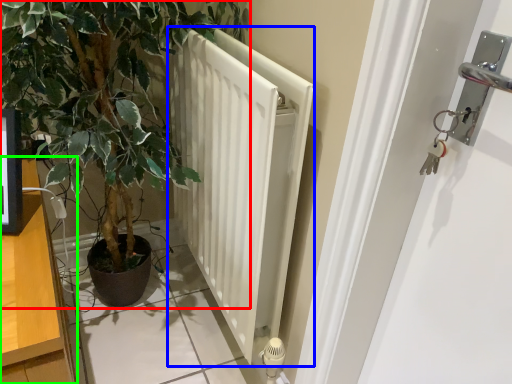
Question: Which is nearer to the houseplant (highlighted by a red box)? radiator (highlighted by a blue box) or dresser (highlighted by a green box).

Choices:
 (A) radiator
 (B) dresser

Answer: (A)